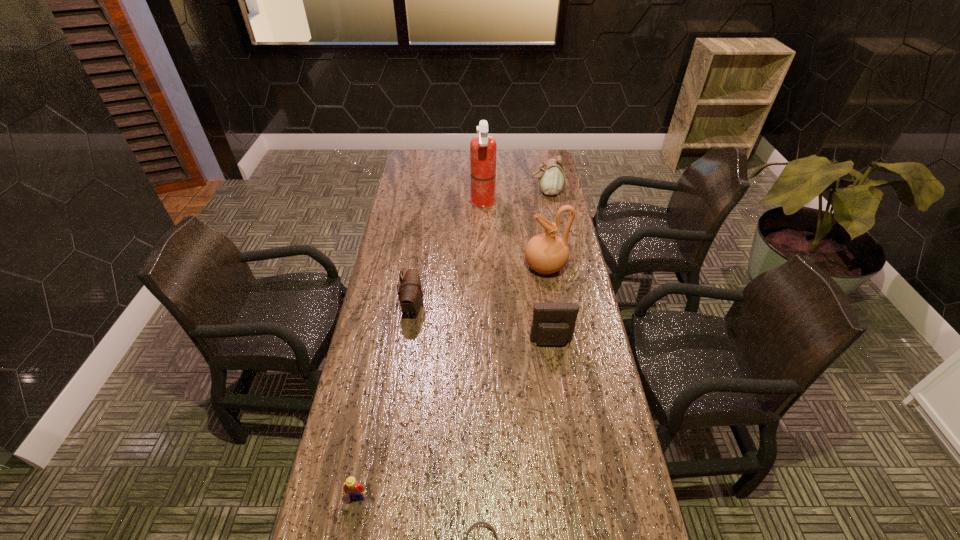
In order to click on pouch located in the left edge section of the desktop in this screenshot , I will do `click(410, 293)`.

Where is `Lego that is at the left edge`? The height and width of the screenshot is (540, 960). Lego that is at the left edge is located at coordinates (352, 487).

The height and width of the screenshot is (540, 960). Find the location of `pottery at the right edge`. pottery at the right edge is located at coordinates (546, 253).

In the image, there is a desktop. Where is `blank space at the far edge`? The image size is (960, 540). blank space at the far edge is located at coordinates (503, 158).

The image size is (960, 540). In the image, there is a desktop. Find the location of `vacant space at the left edge`. vacant space at the left edge is located at coordinates (381, 258).

Find the location of `vacant space at the right edge of the desktop`. vacant space at the right edge of the desktop is located at coordinates (556, 205).

Find the location of a particular element. The height and width of the screenshot is (540, 960). vacant space at the far left corner is located at coordinates (413, 150).

Identify the location of free space between the tallest object and the second tallest object. (515, 234).

At what (x,y) coordinates should I click in order to perform the action: click on vacant area that lies between the third shortest object and the farthest pouch. Please return your answer as a coordinate pair (x, y). Looking at the image, I should click on (480, 249).

Image resolution: width=960 pixels, height=540 pixels. Find the location of `free space that is in between the farthest pouch and the Lego`. free space that is in between the farthest pouch and the Lego is located at coordinates (452, 343).